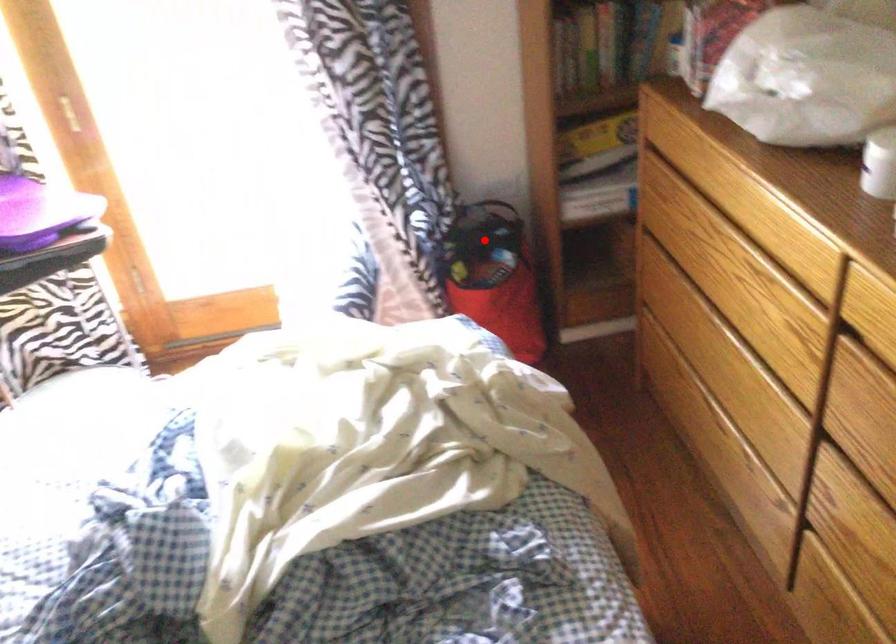
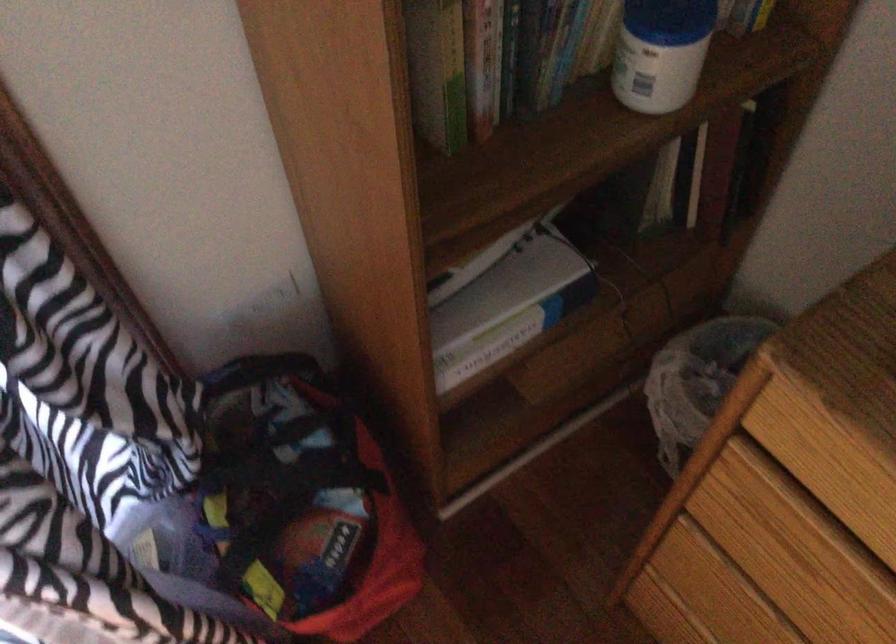
Find the pixel in the second image that matches the highlighted location in the first image.

(300, 502)